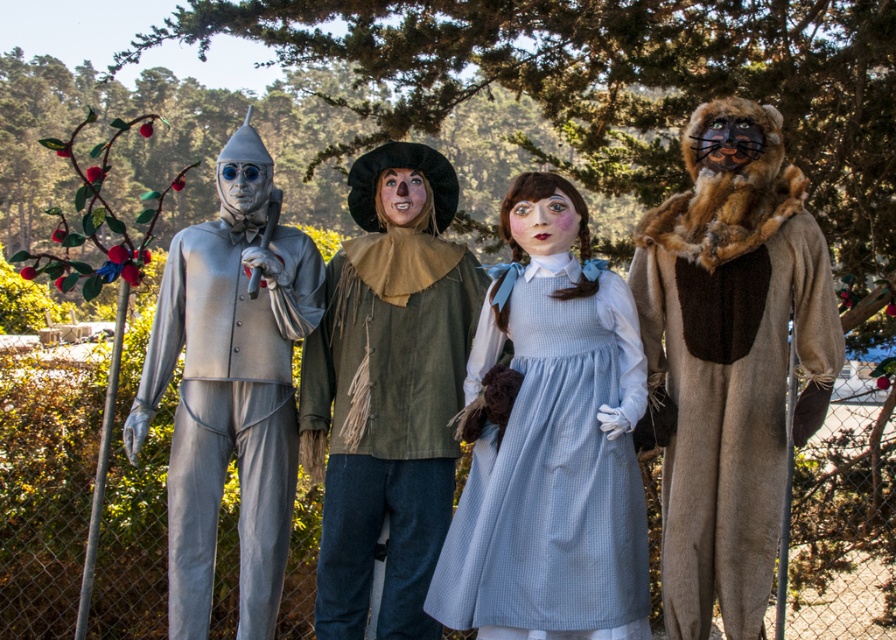
You are a photographer trying to capture a group photo of the fuzzy brown costume at right and the metallic silver suit at left. The camera you have can only focus on objects within a 10 feet range. Will both characters be in focus if you position yourself exactly halfway between them?

The distance between the fuzzy brown costume at right and metallic silver suit at left is 8.82 feet. Positioning yourself halfway would mean each is 4.41 feet away from the camera. Since the camera can focus within 10 feet, both will be in focus.

Consider the image. Which object is located at the coordinates point (731, 356)?

The fuzzy brown costume at right is located at point (731, 356).

You are a photographer trying to capture a group photo of the fuzzy brown costume at right and the green fabric costume at center. Since you want to ensure both are visible in the frame, which costume should you place closer to the camera to avoid blocking the other?

The fuzzy brown costume at right should be placed closer to the camera because it is positioned on the right side of the green fabric costume at center, so moving it forward will prevent it from being blocked by the green fabric costume at center.